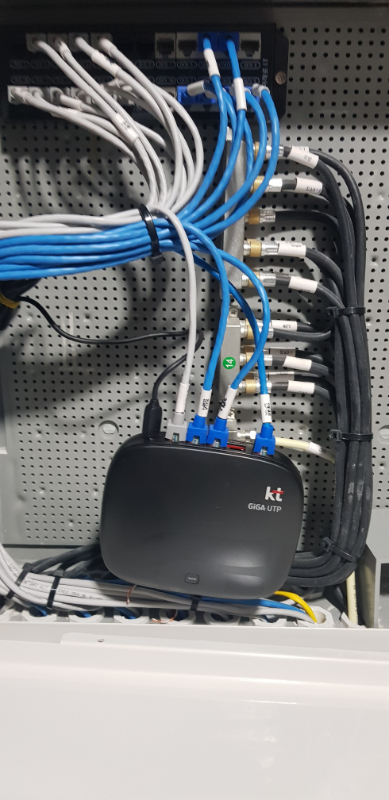
Identify the location of white wires in a connection box. This screenshot has width=389, height=800. (39, 40), (20, 96), (35, 93), (65, 98), (62, 46), (90, 50), (111, 48), (186, 362).